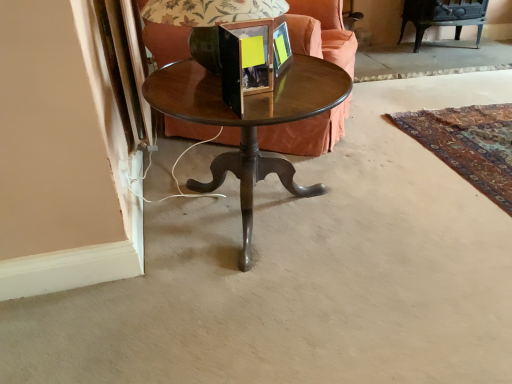
The image size is (512, 384). Find the location of `vacant space to the right of wooden round table at center`. vacant space to the right of wooden round table at center is located at coordinates (406, 214).